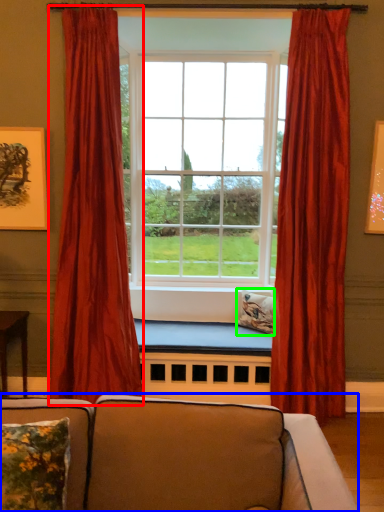
Question: Considering the real-world distances, which object is closest to curtain (highlighted by a red box)? studio couch (highlighted by a blue box) or pillow (highlighted by a green box).

Choices:
 (A) studio couch
 (B) pillow

Answer: (B)